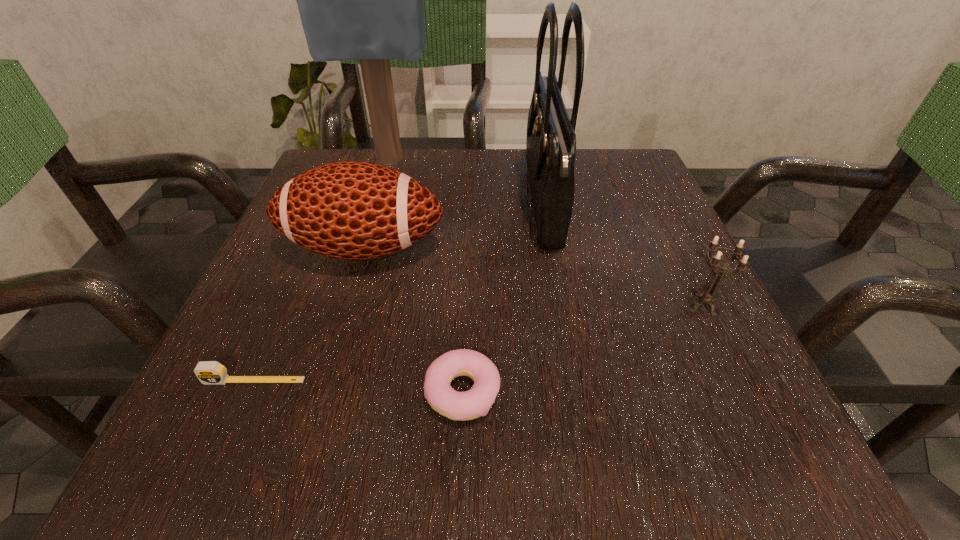
At what (x,y) coordinates should I click in order to perform the action: click on free area in between the doughnut and the fourth shortest object. Please return your answer as a coordinate pair (x, y). Looking at the image, I should click on (414, 321).

This screenshot has height=540, width=960. In order to click on empty space that is in between the tape measure and the rightmost object in this screenshot , I will do `click(478, 343)`.

Locate an element on the screen. The height and width of the screenshot is (540, 960). free area in between the doughnut and the tape measure is located at coordinates (359, 387).

Where is `unoccupied position between the doughnut and the handbag`? The height and width of the screenshot is (540, 960). unoccupied position between the doughnut and the handbag is located at coordinates (503, 298).

Identify the location of vacant space in between the candle holder and the doughnut. (583, 349).

The width and height of the screenshot is (960, 540). I want to click on blank region between the fourth tallest object and the tape measure, so click(x=478, y=343).

Locate an element on the screen. The width and height of the screenshot is (960, 540). vacant point located between the tape measure and the fourth farthest object is located at coordinates (478, 343).

Where is `vacant space in between the football and the doughnut`? vacant space in between the football and the doughnut is located at coordinates (414, 321).

Identify which object is the fifth nearest to the fourth shortest object. Please provide its 2D coordinates. Your answer should be formatted as a tuple, i.e. [(x, y)], where the tuple contains the x and y coordinates of a point satisfying the conditions above.

[(707, 298)]

Identify which object is the fourth closest to the football. Please provide its 2D coordinates. Your answer should be formatted as a tuple, i.e. [(x, y)], where the tuple contains the x and y coordinates of a point satisfying the conditions above.

[(208, 372)]